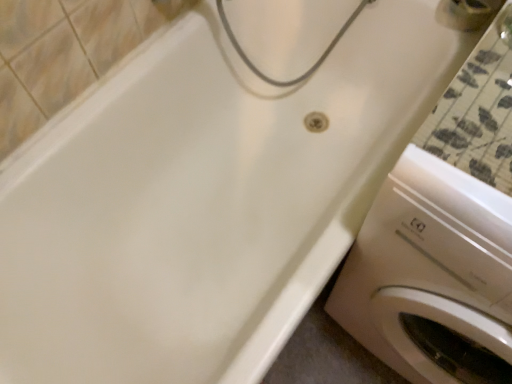
Question: Considering the relative sizes of metallic silver faucet at upper right and white glossy washing machine at lower right in the image provided, is metallic silver faucet at upper right bigger than white glossy washing machine at lower right?

Choices:
 (A) no
 (B) yes

Answer: (A)

Question: Can you confirm if metallic silver faucet at upper right is positioned to the right of white glossy washing machine at lower right?

Choices:
 (A) no
 (B) yes

Answer: (B)

Question: Does metallic silver faucet at upper right have a lesser width compared to white glossy washing machine at lower right?

Choices:
 (A) no
 (B) yes

Answer: (B)

Question: From the image's perspective, is metallic silver faucet at upper right located beneath white glossy washing machine at lower right?

Choices:
 (A) no
 (B) yes

Answer: (A)

Question: Is metallic silver faucet at upper right further to the viewer compared to white glossy washing machine at lower right?

Choices:
 (A) no
 (B) yes

Answer: (B)

Question: Is white glossy washing machine at lower right at the back of metallic silver faucet at upper right?

Choices:
 (A) yes
 (B) no

Answer: (B)

Question: Is white glossy washing machine at lower right thinner than metallic silver faucet at upper right?

Choices:
 (A) no
 (B) yes

Answer: (A)

Question: Is white glossy washing machine at lower right closer to camera compared to metallic silver faucet at upper right?

Choices:
 (A) no
 (B) yes

Answer: (B)

Question: Is white glossy washing machine at lower right turned away from metallic silver faucet at upper right?

Choices:
 (A) no
 (B) yes

Answer: (A)

Question: Is white glossy washing machine at lower right smaller than metallic silver faucet at upper right?

Choices:
 (A) yes
 (B) no

Answer: (B)

Question: Considering the relative positions of white glossy washing machine at lower right and metallic silver faucet at upper right in the image provided, is white glossy washing machine at lower right behind metallic silver faucet at upper right?

Choices:
 (A) yes
 (B) no

Answer: (B)

Question: Considering the relative sizes of white glossy washing machine at lower right and metallic silver faucet at upper right in the image provided, is white glossy washing machine at lower right taller than metallic silver faucet at upper right?

Choices:
 (A) no
 (B) yes

Answer: (B)

Question: Based on their sizes in the image, would you say white glossy washing machine at lower right is bigger or smaller than metallic silver faucet at upper right?

Choices:
 (A) small
 (B) big

Answer: (B)